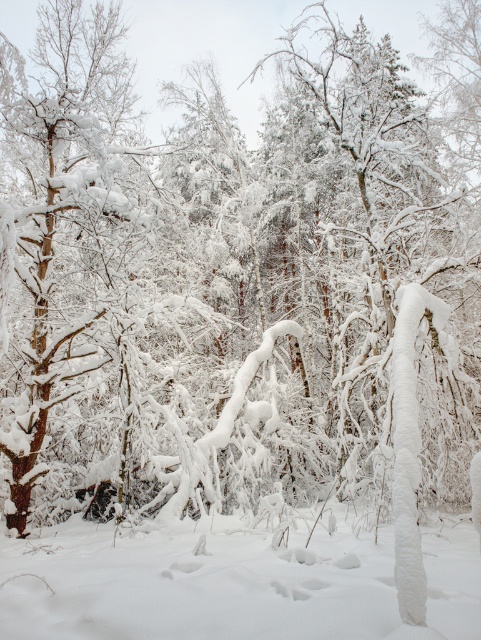
Question: Is white fluffy snow at center bigger than brown rough tree trunk at left?

Choices:
 (A) yes
 (B) no

Answer: (B)

Question: From the image, what is the correct spatial relationship of white fluffy snow at center in relation to brown rough tree trunk at left?

Choices:
 (A) right
 (B) left

Answer: (A)

Question: From the image, what is the correct spatial relationship of white fluffy snow at center in relation to brown rough tree trunk at left?

Choices:
 (A) above
 (B) below

Answer: (B)

Question: Among these objects, which one is nearest to the camera?

Choices:
 (A) brown rough tree trunk at left
 (B) white fluffy snow at center

Answer: (B)

Question: Which point is farther to the camera?

Choices:
 (A) white fluffy snow at center
 (B) brown rough tree trunk at left

Answer: (B)

Question: Which point is farther to the camera?

Choices:
 (A) (3, 54)
 (B) (258, 538)

Answer: (A)